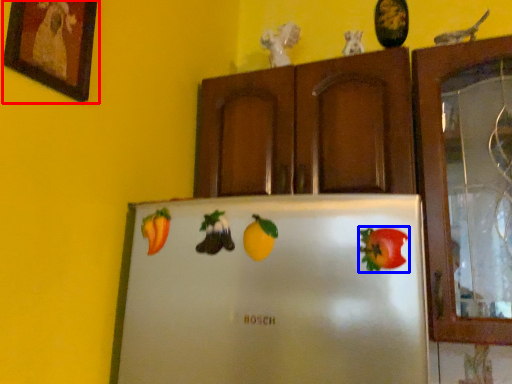
Question: Which point is closer to the camera, picture frame (highlighted by a red box) or fruit (highlighted by a blue box)?

Choices:
 (A) picture frame
 (B) fruit

Answer: (A)